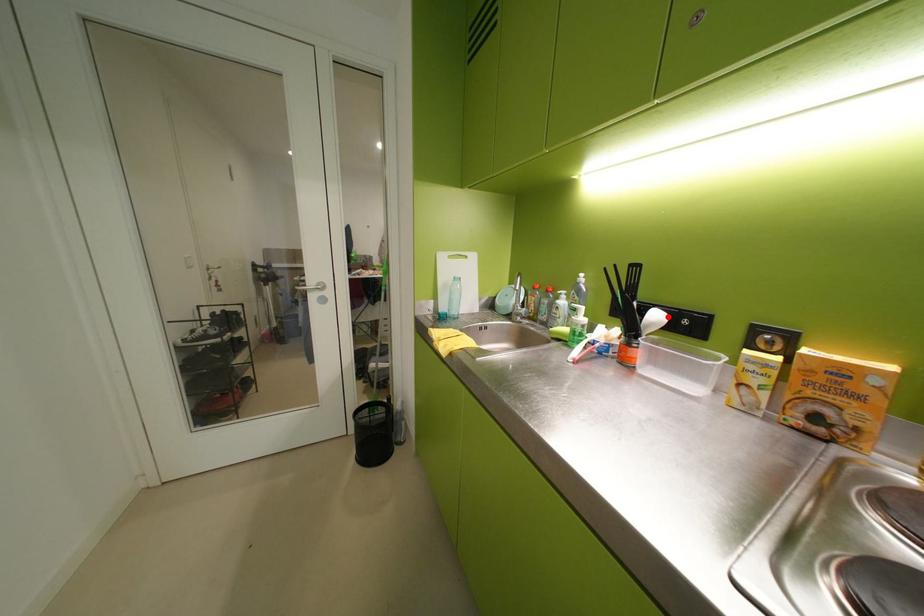
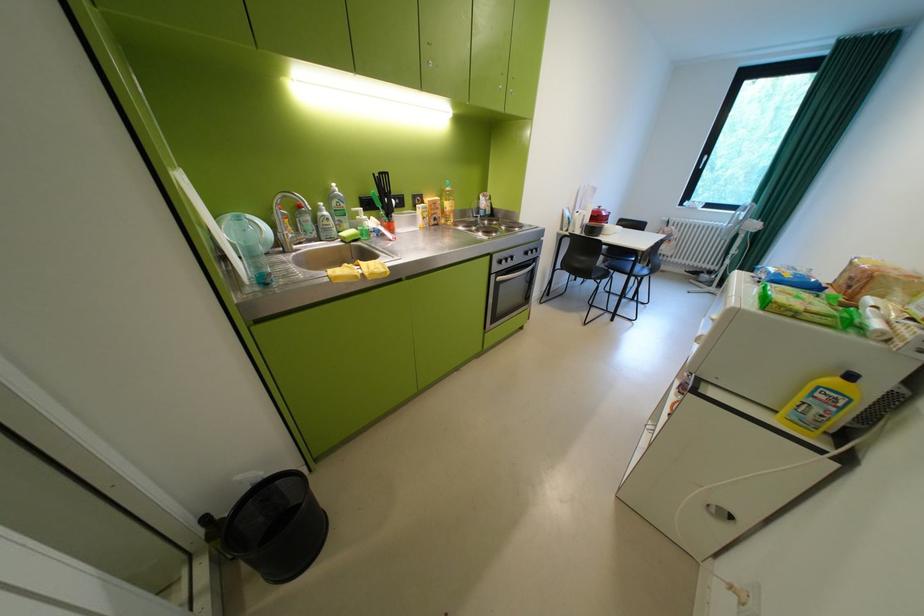
Question: I am providing you with two images of the same scene from different viewpoints. A red point is marked on the first image. Is the red point's position out of view in image 2?

Choices:
 (A) Yes
 (B) No

Answer: (A)